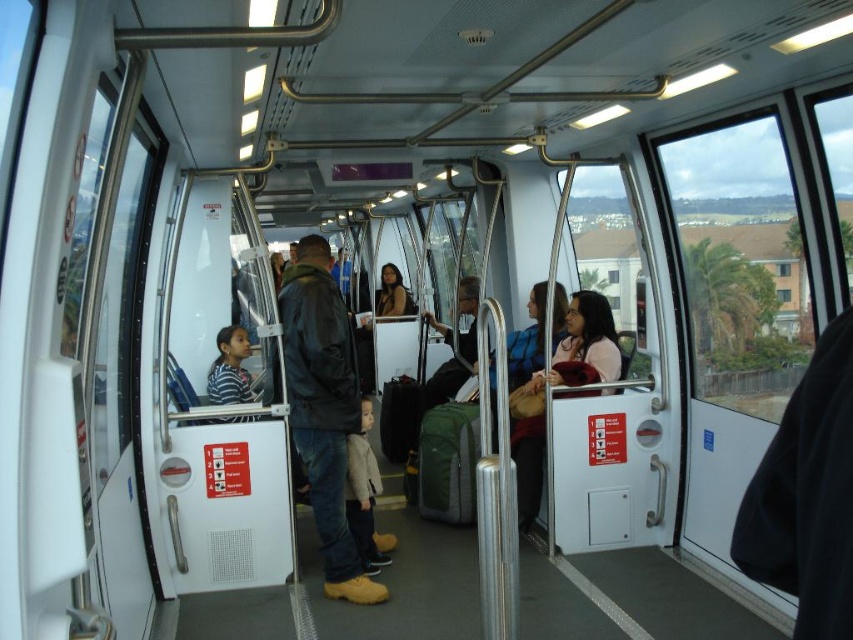
Is leather jacket at center wider than light beige sweater at center?

Indeed, leather jacket at center has a greater width compared to light beige sweater at center.

Consider the image. Does leather jacket at center have a greater height compared to light beige sweater at center?

Correct, leather jacket at center is much taller as light beige sweater at center.

Is point (305, 332) more distant than point (357, 452)?

No, it is not.

Where is `leather jacket at center`? The image size is (853, 640). leather jacket at center is located at coordinates (323, 408).